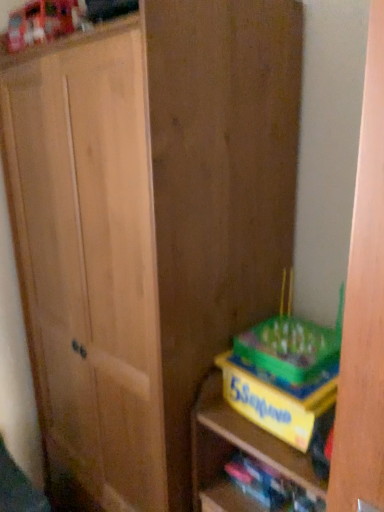
Question: Is the position of yellow cardboard book at lower right less distant than that of yellow cardboard game at lower right?

Choices:
 (A) no
 (B) yes

Answer: (A)

Question: Is yellow cardboard book at lower right outside of yellow cardboard game at lower right?

Choices:
 (A) yes
 (B) no

Answer: (B)

Question: From a real-world perspective, does yellow cardboard book at lower right sit lower than yellow cardboard game at lower right?

Choices:
 (A) yes
 (B) no

Answer: (B)

Question: Considering the relative positions of yellow cardboard book at lower right and yellow cardboard game at lower right in the image provided, is yellow cardboard book at lower right to the right of yellow cardboard game at lower right from the viewer's perspective?

Choices:
 (A) yes
 (B) no

Answer: (B)

Question: Could you tell me if yellow cardboard book at lower right is turned towards yellow cardboard game at lower right?

Choices:
 (A) yes
 (B) no

Answer: (A)

Question: From a real-world perspective, is yellow cardboard book at lower right positioned above or below yellow cardboard game box at lower right?

Choices:
 (A) below
 (B) above

Answer: (A)

Question: Looking at their shapes, would you say yellow cardboard book at lower right is wider or thinner than yellow cardboard game box at lower right?

Choices:
 (A) thin
 (B) wide

Answer: (A)

Question: Is yellow cardboard book at lower right in front of or behind yellow cardboard game box at lower right in the image?

Choices:
 (A) behind
 (B) front

Answer: (A)

Question: Considering the relative positions of yellow cardboard book at lower right and yellow cardboard game box at lower right in the image provided, is yellow cardboard book at lower right to the left or to the right of yellow cardboard game box at lower right?

Choices:
 (A) right
 (B) left

Answer: (B)

Question: Is yellow cardboard game box at lower right taller or shorter than yellow cardboard book at lower right?

Choices:
 (A) tall
 (B) short

Answer: (A)

Question: Is yellow cardboard game box at lower right wider or thinner than yellow cardboard book at lower right?

Choices:
 (A) thin
 (B) wide

Answer: (B)

Question: Do you think yellow cardboard game box at lower right is within yellow cardboard book at lower right, or outside of it?

Choices:
 (A) inside
 (B) outside

Answer: (B)

Question: Considering the relative positions of yellow cardboard game box at lower right and yellow cardboard book at lower right in the image provided, is yellow cardboard game box at lower right to the left or to the right of yellow cardboard book at lower right?

Choices:
 (A) left
 (B) right

Answer: (B)

Question: Would you say yellow cardboard game at lower right is inside or outside yellow cardboard game box at lower right?

Choices:
 (A) inside
 (B) outside

Answer: (B)

Question: Relative to yellow cardboard game box at lower right, is yellow cardboard game at lower right in front or behind?

Choices:
 (A) front
 (B) behind

Answer: (A)